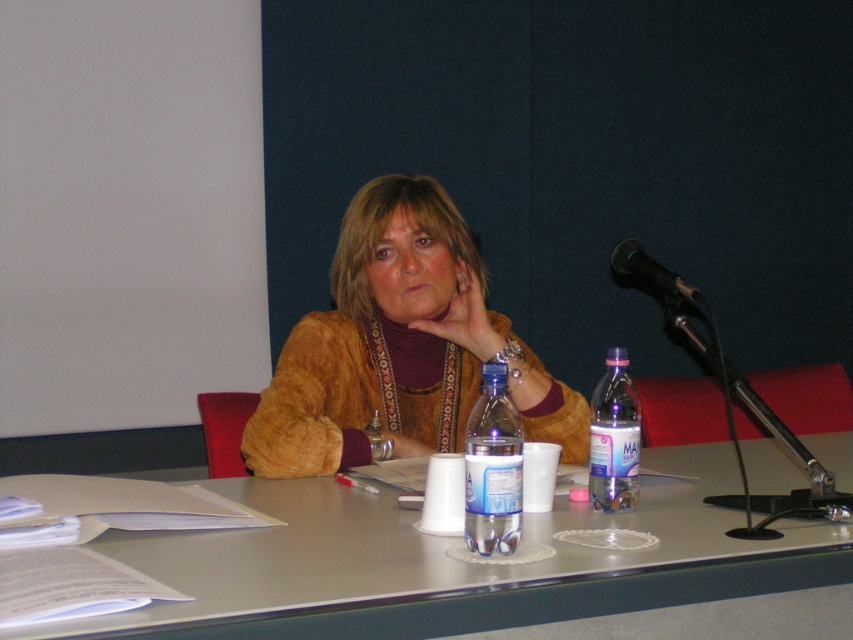
Question: Which point is farther from the camera taking this photo?

Choices:
 (A) (482, 355)
 (B) (619, 497)
 (C) (409, 442)
 (D) (618, 262)

Answer: (A)

Question: Based on their relative distances, which object is nearer to the suede-like brown jacket at center?

Choices:
 (A) metallic gray table at center
 (B) black metallic microphone at upper right
 (C) matte gold bracelet at lower center

Answer: (C)

Question: Can you confirm if translucent plastic bottle at right is positioned to the left of black metallic microphone at upper right?

Choices:
 (A) no
 (B) yes

Answer: (B)

Question: Is matte gold bracelet at upper center smaller than matte gold bracelet at lower center?

Choices:
 (A) yes
 (B) no

Answer: (B)

Question: Which point is closer to the camera?

Choices:
 (A) (482, 548)
 (B) (607, 445)
 (C) (430, 310)

Answer: (A)

Question: Does translucent plastic bottle at center have a lesser width compared to black metallic microphone at upper right?

Choices:
 (A) no
 (B) yes

Answer: (B)